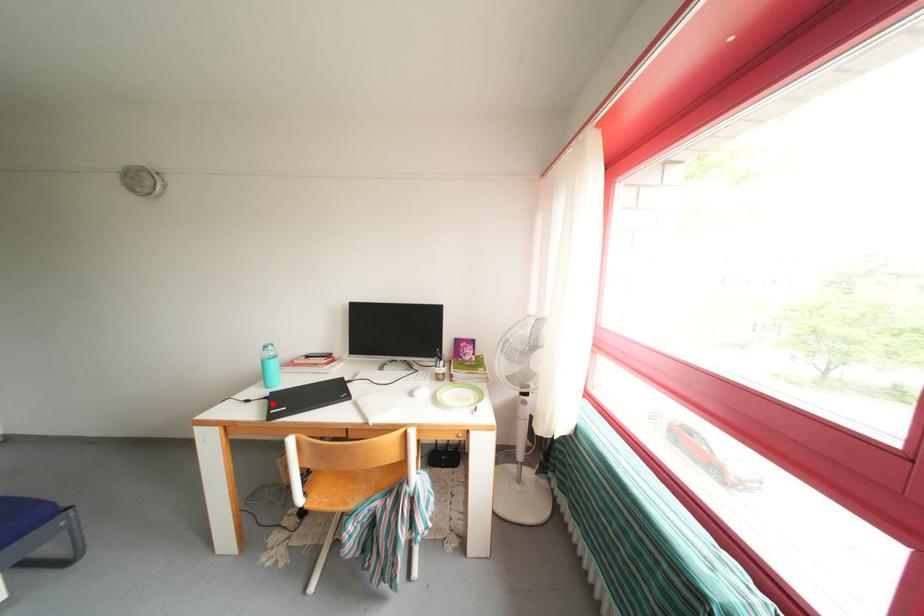
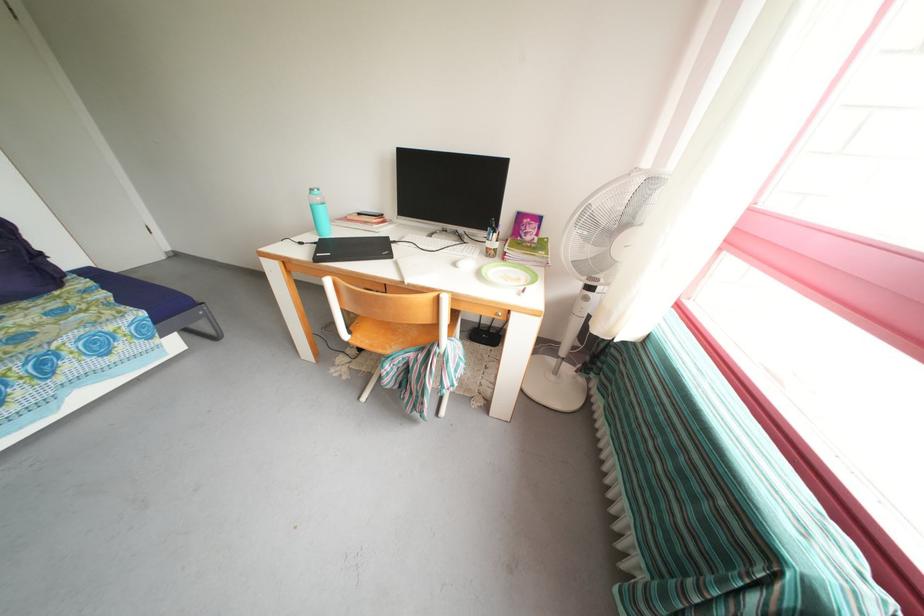
Locate, in the second image, the point that corresponds to the highlighted location in the first image.

(322, 249)